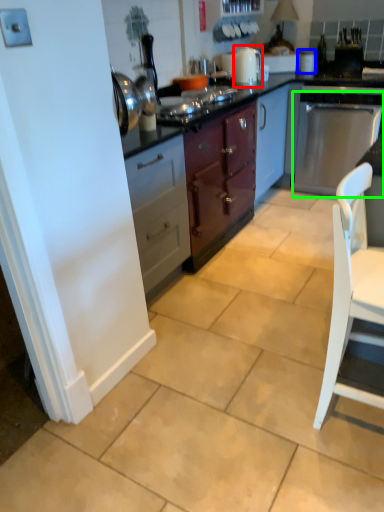
Question: Which is nearer to the kitchen appliance (highlighted by a red box)? appliance (highlighted by a blue box) or kitchen appliance (highlighted by a green box).

Choices:
 (A) appliance
 (B) kitchen appliance

Answer: (A)